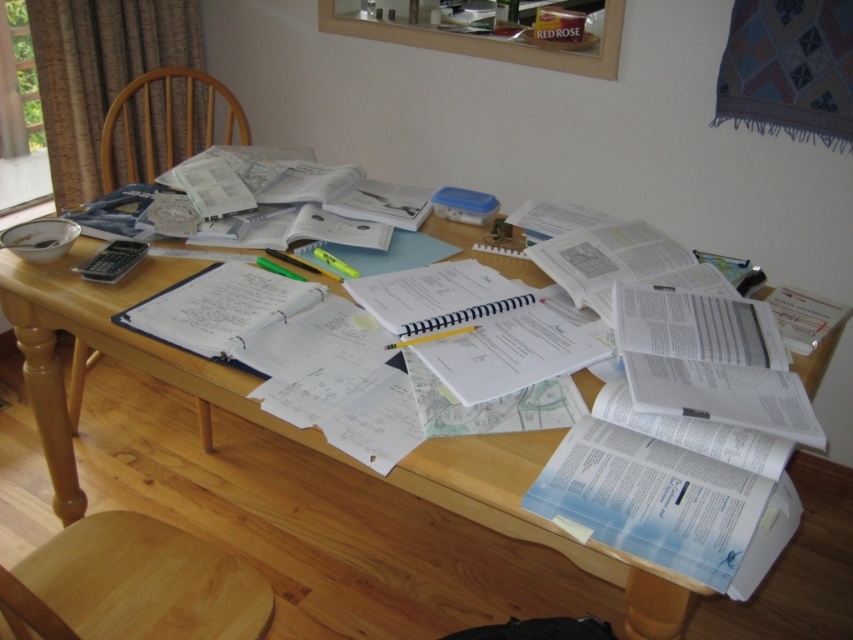
You are sitting at the table and want to move to the chair closest to the wall. Which chair should you choose between the light brown wood chair at lower left and the wooden chair at left?

The wooden chair at left is closer to the wall because the light brown wood chair at lower left is to the right of it, meaning the wooden chair at left is positioned further left and thus closer to the wall.

You are sitting at the table in the home office and need to move your chair closer to the desk. Which chair, the light brown wood chair at lower left or the wooden chair at left, is shorter and thus easier to move under the table?

The light brown wood chair at lower left is not as tall as the wooden chair at left, making it easier to move under the table due to its shorter height.